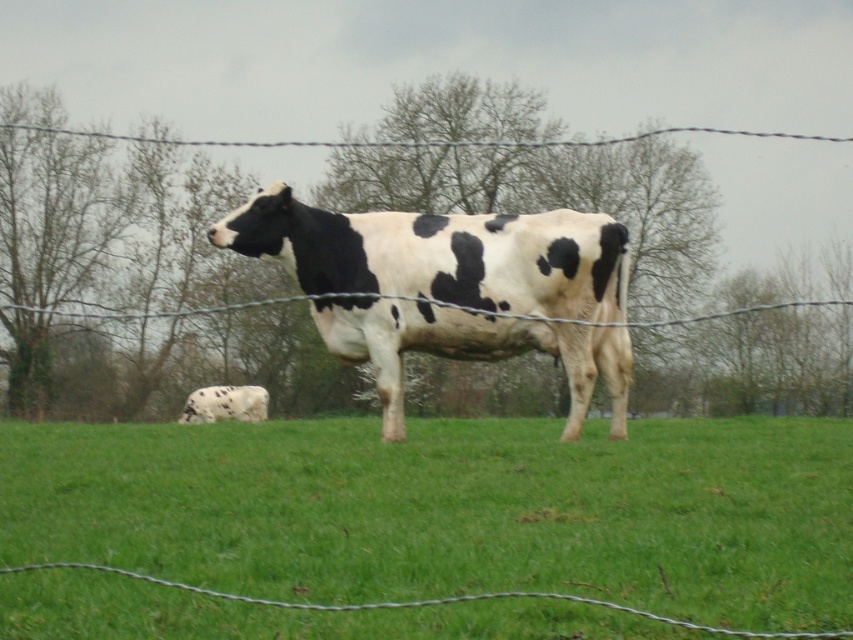
Is point (445, 294) behind point (247, 397)?

No, it is not.

Locate an element on the screen. The height and width of the screenshot is (640, 853). black and white spotted cow at center is located at coordinates (440, 253).

Which is in front, point (480, 230) or point (219, 387)?

Positioned in front is point (480, 230).

Where is `black and white spotted cow at center`? black and white spotted cow at center is located at coordinates (440, 253).

Does point (619, 612) lie in front of point (219, 413)?

That is True.

Is green grass at center taller than white spotted cow at lower left?

In fact, green grass at center may be shorter than white spotted cow at lower left.

Who is more distant from viewer, (817,589) or (202,420)?

The point (202,420) is behind.

Locate an element on the screen. green grass at center is located at coordinates (453, 509).

In the scene shown: Which is more to the right, green grass at center or wire at center?

From the viewer's perspective, wire at center appears more on the right side.

Does point (96, 492) lie behind point (453, 305)?

No, (96, 492) is closer to viewer.

This screenshot has width=853, height=640. In order to click on green grass at center in this screenshot , I will do `click(453, 509)`.